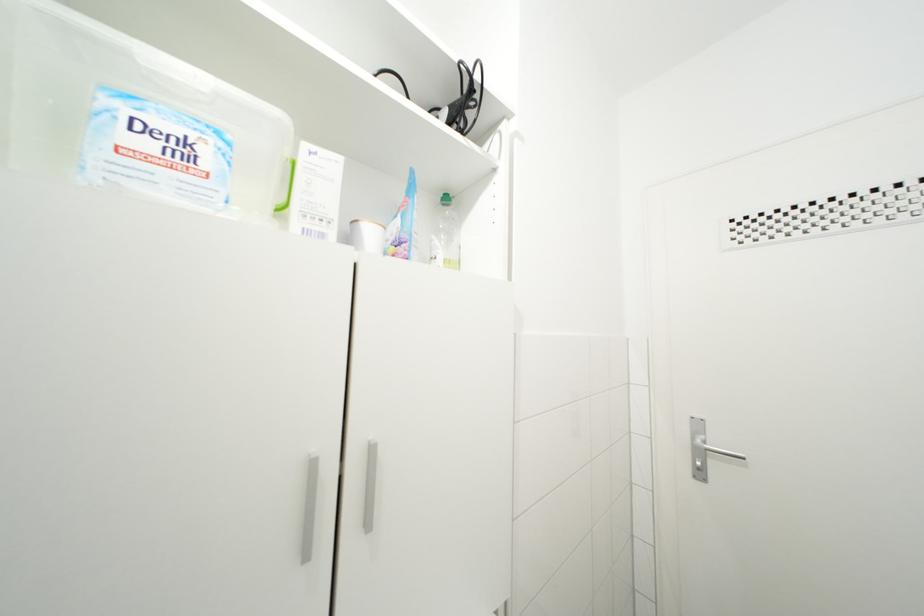
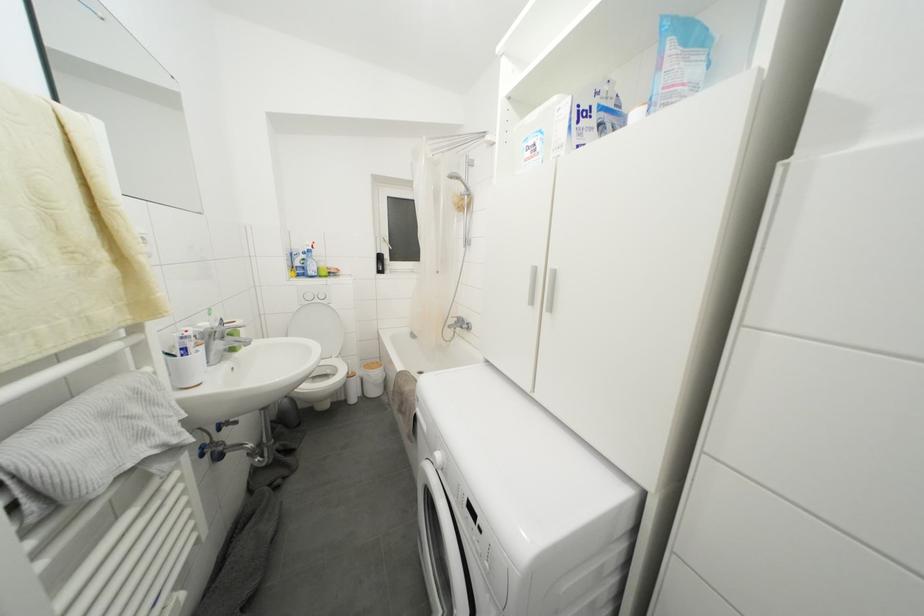
The point at (196,164) is marked in the first image. Where is the corresponding point in the second image?

(540, 155)